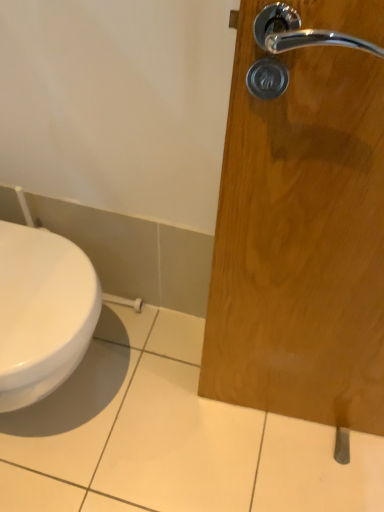
Question: Is white glossy toilet at lower left positioned with its back to satin nickel door handle at lower right?

Choices:
 (A) yes
 (B) no

Answer: (B)

Question: Can you confirm if white glossy toilet at lower left is wider than satin nickel door handle at lower right?

Choices:
 (A) yes
 (B) no

Answer: (A)

Question: Is white glossy toilet at lower left smaller than satin nickel door handle at lower right?

Choices:
 (A) yes
 (B) no

Answer: (B)

Question: Is satin nickel door handle at lower right inside white glossy toilet at lower left?

Choices:
 (A) yes
 (B) no

Answer: (B)

Question: Is white glossy toilet at lower left positioned behind satin nickel door handle at lower right?

Choices:
 (A) no
 (B) yes

Answer: (A)

Question: Does white glossy toilet at lower left appear on the left side of satin nickel door handle at lower right?

Choices:
 (A) yes
 (B) no

Answer: (A)

Question: Is satin nickel door handle at lower right looking in the opposite direction of white glossy toilet at lower left?

Choices:
 (A) no
 (B) yes

Answer: (B)

Question: Is satin nickel door handle at lower right shorter than white glossy toilet at lower left?

Choices:
 (A) yes
 (B) no

Answer: (A)

Question: From a real-world perspective, is satin nickel door handle at lower right over white glossy toilet at lower left?

Choices:
 (A) yes
 (B) no

Answer: (B)

Question: Are satin nickel door handle at lower right and white glossy toilet at lower left far apart?

Choices:
 (A) no
 (B) yes

Answer: (A)

Question: Does satin nickel door handle at lower right turn towards white glossy toilet at lower left?

Choices:
 (A) no
 (B) yes

Answer: (A)

Question: Is satin nickel door handle at lower right outside of white glossy toilet at lower left?

Choices:
 (A) no
 (B) yes

Answer: (B)

Question: Is white glossy toilet at lower left wider or thinner than satin nickel door handle at lower right?

Choices:
 (A) thin
 (B) wide

Answer: (B)